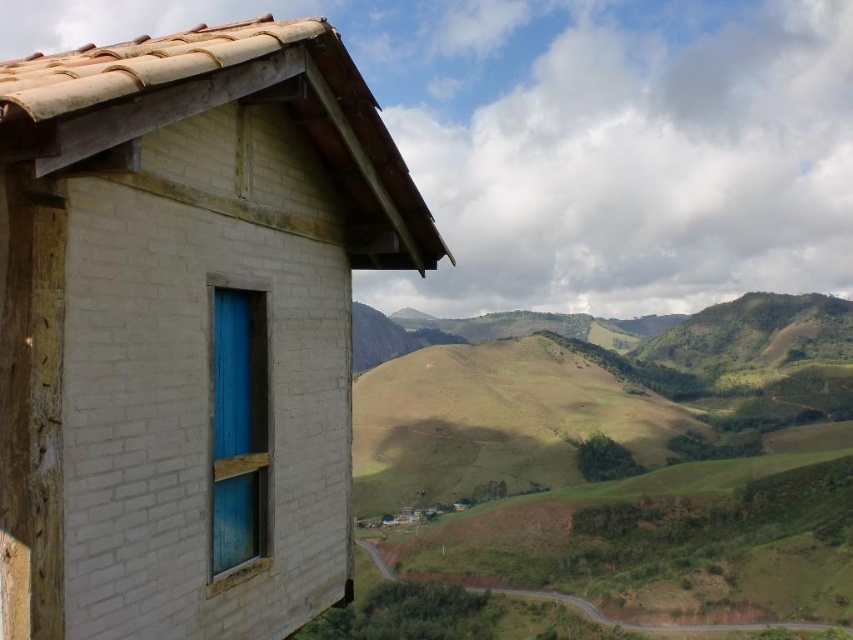
Can you confirm if white brick hut at upper left is shorter than blue painted wood window at center?

Incorrect, white brick hut at upper left's height does not fall short of blue painted wood window at center's.

Between point (310, 188) and point (262, 532), which one is positioned behind?

Positioned behind is point (310, 188).

Which is in front, point (97, 394) or point (251, 445)?

Point (97, 394)

You are a GUI agent. You are given a task and a screenshot of the screen. Output one action in this format:
    pyautogui.click(x=<x>, y=<y>)
    Task: Click on the white brick hut at upper left
    
    Given the screenshot: What is the action you would take?
    pyautogui.click(x=186, y=328)